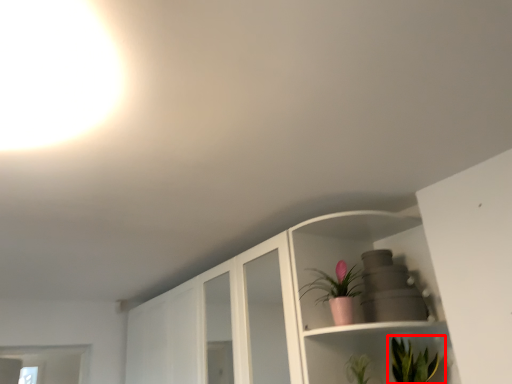
Question: From the image's perspective, where is houseplant (annotated by the red box) located in relation to houseplant in the image?

Choices:
 (A) above
 (B) below

Answer: (B)